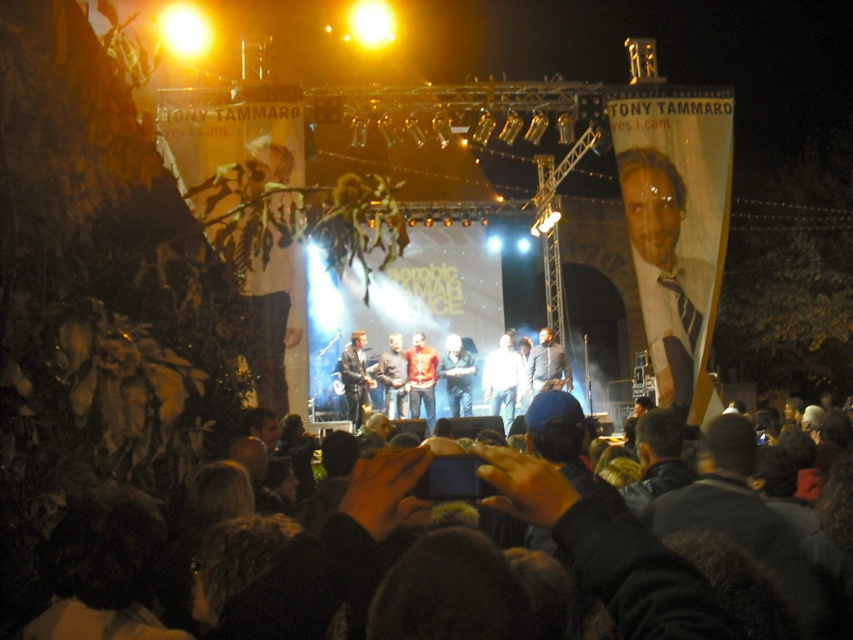
Question: Among these objects, which one is nearest to the camera?

Choices:
 (A) denim jacket at center
 (B) dark blue jeans at center
 (C) dark brown leather jacket at center

Answer: (B)

Question: Is the position of dark clothing at lower center less distant than that of dark blue jeans at center?

Choices:
 (A) yes
 (B) no

Answer: (A)

Question: Does blue striped tie at right have a smaller size compared to dark brown leather jacket at center?

Choices:
 (A) no
 (B) yes

Answer: (A)

Question: Which object appears closest to the camera in this image?

Choices:
 (A) blue striped tie at right
 (B) white matte shirt at center
 (C) dark gray sweater at center
 (D) leather jacket at center

Answer: (A)

Question: Can you confirm if white matte shirt at center is positioned to the right of leather jacket at center?

Choices:
 (A) yes
 (B) no

Answer: (A)

Question: Based on their relative distances, which object is farther from the blue striped tie at right?

Choices:
 (A) reddish-brown leather jacket at center
 (B) dark brown leather jacket at center
 (C) dark gray sweater at center

Answer: (C)